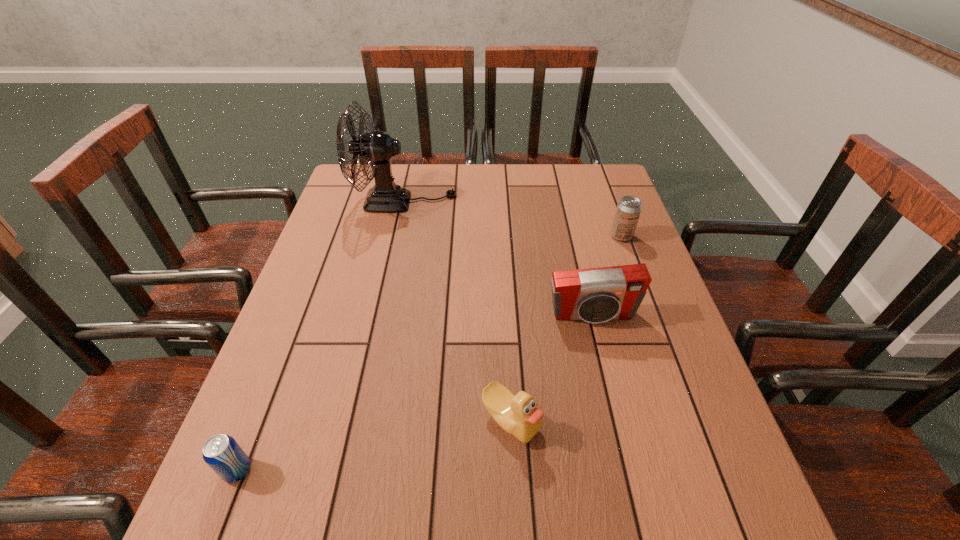
Where is `free space located 0.200m in front of the fourth object from right to left, indicating the direction of air flow`? Image resolution: width=960 pixels, height=540 pixels. free space located 0.200m in front of the fourth object from right to left, indicating the direction of air flow is located at coordinates (519, 202).

Locate an element on the screen. free space located on the front-facing side of the second object from right to left is located at coordinates (607, 376).

Where is `vacant space located on the front of the second farthest object`? This screenshot has height=540, width=960. vacant space located on the front of the second farthest object is located at coordinates (647, 306).

Identify the location of blank area located at the beak of the second nearest object. (517, 538).

Locate an element on the screen. free space located 0.290m on the back of the shorter beer can is located at coordinates (291, 333).

Find the location of a particular element. The image size is (960, 540). object present at the far edge is located at coordinates (377, 148).

Locate an element on the screen. The width and height of the screenshot is (960, 540). fan at the left edge is located at coordinates (377, 148).

Locate an element on the screen. This screenshot has width=960, height=540. beer can located at the left edge is located at coordinates (222, 453).

Image resolution: width=960 pixels, height=540 pixels. I want to click on camera that is positioned at the right edge, so click(x=596, y=295).

Image resolution: width=960 pixels, height=540 pixels. I want to click on beer can at the right edge, so click(x=628, y=210).